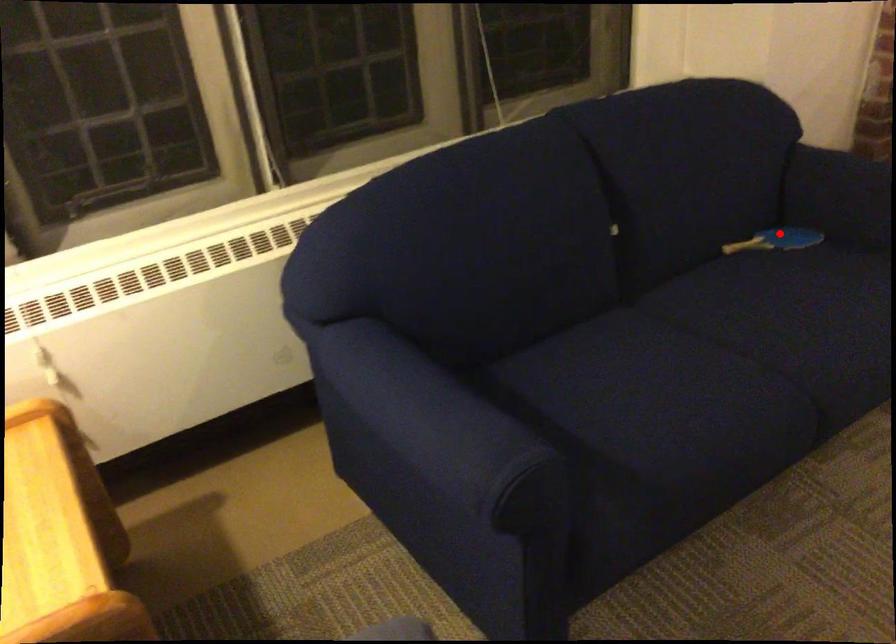
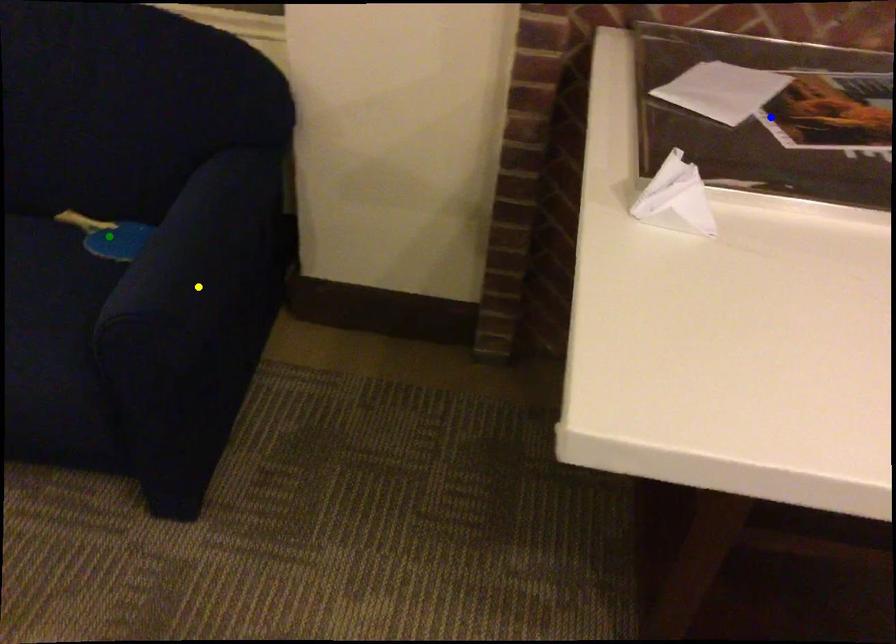
Question: I am providing you with two images of the same scene from different viewpoints. A red point is marked on the first image. You are given multiple points on the second image. Can you choose the point in image 2 that corresponds to the point in image 1?

Choices:
 (A) green point
 (B) blue point
 (C) yellow point

Answer: (A)